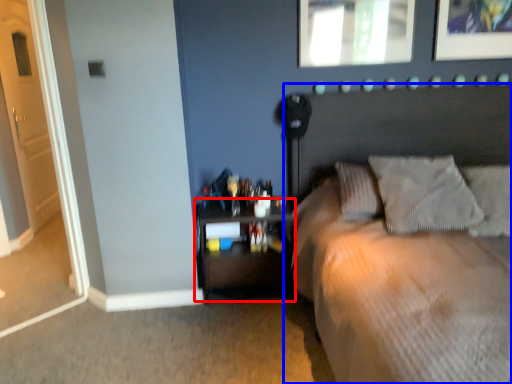
Question: Which point is further to the camera, nightstand (highlighted by a red box) or bed (highlighted by a blue box)?

Choices:
 (A) nightstand
 (B) bed

Answer: (A)